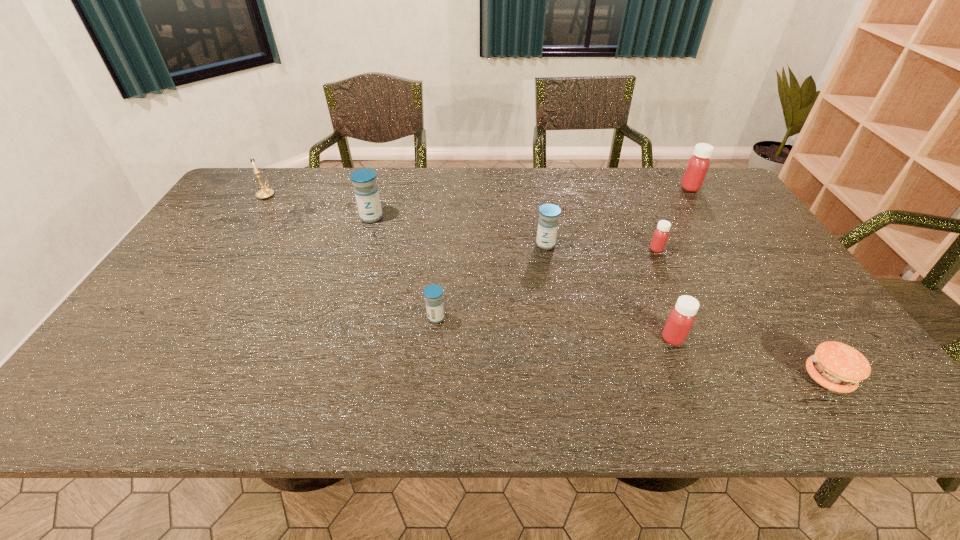
At what (x,y) coordinates should I click in order to perform the action: click on the second nearest red medicine. Please return your answer as a coordinate pair (x, y). This screenshot has height=540, width=960. Looking at the image, I should click on point(660,236).

The width and height of the screenshot is (960, 540). I want to click on the second red medicine from right to left, so click(660, 236).

Where is `the fifth farthest medicine`? The width and height of the screenshot is (960, 540). the fifth farthest medicine is located at coordinates coord(433,293).

At what (x,y) coordinates should I click in order to perform the action: click on the sixth farthest object. Please return your answer as a coordinate pair (x, y). Looking at the image, I should click on (433, 293).

You are a GUI agent. You are given a task and a screenshot of the screen. Output one action in this format:
    pyautogui.click(x=<x>, y=<y>)
    Task: Click on the patty
    This screenshot has height=540, width=960.
    Given the screenshot: What is the action you would take?
    pyautogui.click(x=838, y=367)

Identify the location of the nearest object. The width and height of the screenshot is (960, 540). tap(838, 367).

Image resolution: width=960 pixels, height=540 pixels. I want to click on free space located on the left of the rightmost red medicine, so click(651, 188).

Where is `vacant area located 0.340m on the left of the biggest blue medicine`? This screenshot has height=540, width=960. vacant area located 0.340m on the left of the biggest blue medicine is located at coordinates [251, 218].

I want to click on blank area located on the handle side of the gold candle holder, so click(x=280, y=174).

This screenshot has height=540, width=960. Identify the location of vacant area situated 0.140m on the handle side of the gold candle holder. (284, 168).